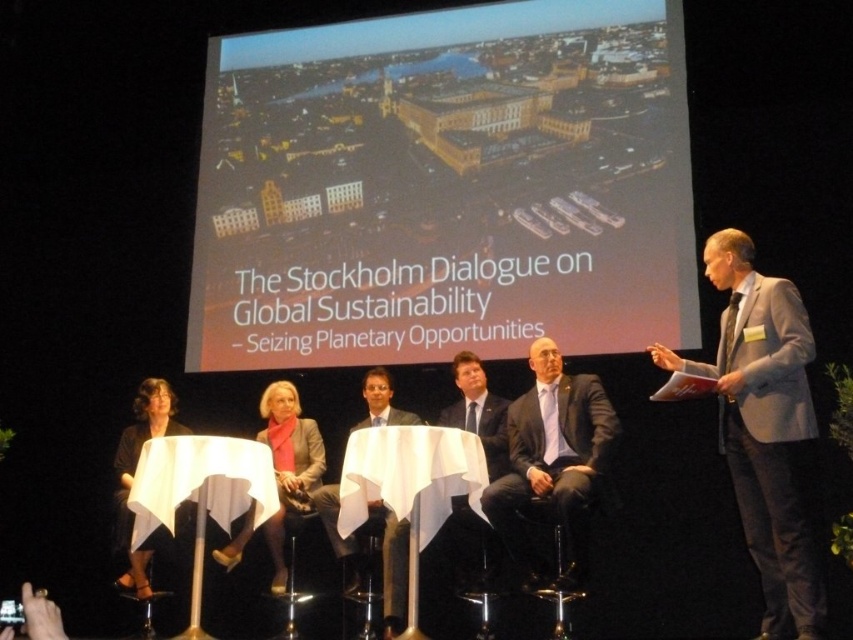
You are a photographer at the event and want to capture a photo of both the dark gray suit at center and the matte gray blazer at center. Since you want to ensure both are fully visible in the frame, which one should you focus on first to maintain their proportions?

The dark gray suit at center is much taller than the matte gray blazer at center, so focusing on the dark gray suit at center first will help maintain proportions as it occupies more vertical space in the frame.

You are standing at the front of the stage facing the audience. There are two points marked on the stage floor. One is at coordinate point (679, 170) and the other at point (572, 465). If you want to walk towards the back of the stage, which point would you pass first?

You would pass point (572, 465) first because point (679, 170) is located behind it relative to your position at the front of the stage.

Consider the image. You are an event planner who needs to ensure that the black fabric dress at center is visible to all attendees. Given that the matte yellow building at upper center is blocking part of the view, how might you adjust the stage setup to improve visibility?

Since the matte yellow building at upper center is above the black fabric dress at center, lowering the matte yellow building at upper center or moving the black fabric dress at center to a position where it is not directly beneath the building would improve visibility for attendees.